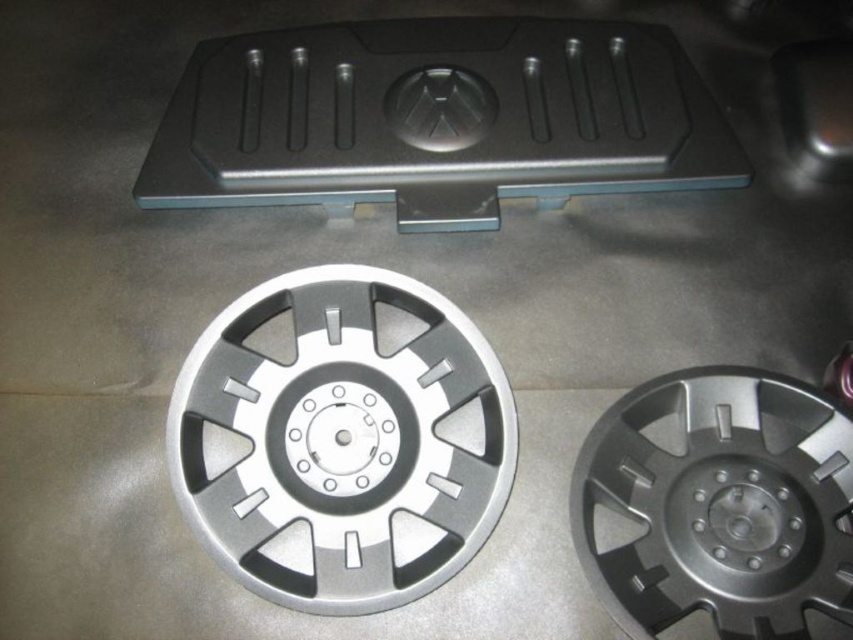
Question: Which object is positioned closest to the silver metallic hubcap at center?

Choices:
 (A) silver metallic wheel at center
 (B) black plastic cover at center

Answer: (B)

Question: Can you confirm if silver metallic hubcap at center is thinner than silver metallic wheel at center?

Choices:
 (A) no
 (B) yes

Answer: (A)

Question: Which point appears farthest from the camera in this image?

Choices:
 (A) (398, 401)
 (B) (775, 550)
 (C) (608, 163)

Answer: (C)

Question: Which object is farther from the camera taking this photo?

Choices:
 (A) black plastic cover at center
 (B) silver metallic wheel at center

Answer: (A)

Question: Can you confirm if black plastic cover at center is positioned to the right of silver metallic wheel at center?

Choices:
 (A) yes
 (B) no

Answer: (B)

Question: Is black plastic cover at center above silver metallic wheel at center?

Choices:
 (A) no
 (B) yes

Answer: (B)